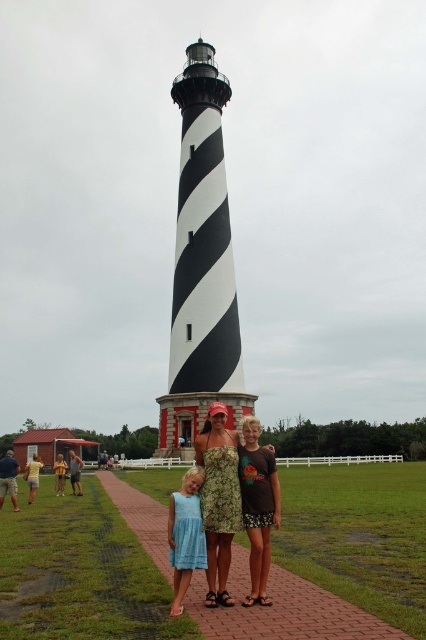
Can you confirm if floral dress at center is positioned to the left of light blue fabric dress at center?

Incorrect, floral dress at center is not on the left side of light blue fabric dress at center.

Does floral dress at center have a larger size compared to light blue fabric dress at center?

Correct, floral dress at center is larger in size than light blue fabric dress at center.

In order to click on floral dress at center in this screenshot , I will do `click(218, 499)`.

At what (x,y) coordinates should I click in order to perform the action: click on floral dress at center. Please return your answer as a coordinate pair (x, y). Looking at the image, I should click on [x=218, y=499].

Between floral dress at center and matte floral dress at center, which one appears on the right side from the viewer's perspective?

Positioned to the right is floral dress at center.

Does point (204, 460) come in front of point (106, 458)?

Yes.

Find the location of `floral dress at center`. floral dress at center is located at coordinates (218, 499).

Can you confirm if light blue fabric dress at center is positioned to the right of matte floral dress at center?

Yes, light blue fabric dress at center is to the right of matte floral dress at center.

Which is in front, point (189, 525) or point (111, 465)?

Positioned in front is point (189, 525).

Where is `light blue fabric dress at center`? The image size is (426, 640). light blue fabric dress at center is located at coordinates (186, 536).